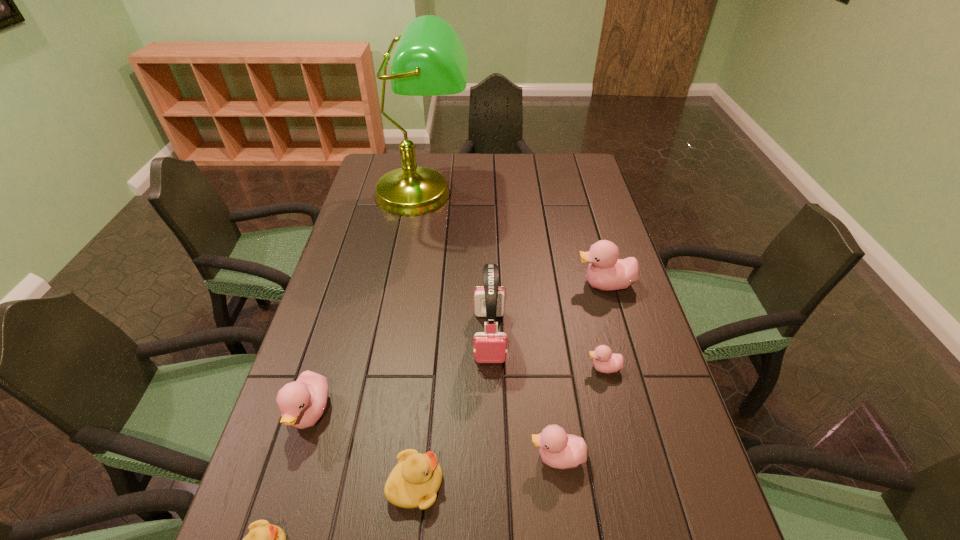
Identify the location of object that is the nearest to the nearest duckling. Image resolution: width=960 pixels, height=540 pixels. click(302, 402).

Locate an element on the screen. object that is the seventh closest to the farthest duckling is located at coordinates (264, 539).

Select which duckling appears as the second closest to the second biggest pink duckling. Please provide its 2D coordinates. Your answer should be formatted as a tuple, i.e. [(x, y)], where the tuple contains the x and y coordinates of a point satisfying the conditions above.

[(414, 482)]

Select which duckling appears as the second closest to the fifth nearest duckling. Please provide its 2D coordinates. Your answer should be formatted as a tuple, i.e. [(x, y)], where the tuple contains the x and y coordinates of a point satisfying the conditions above.

[(606, 272)]

Locate which pink duckling is the second closest to the farthest pink duckling. Please provide its 2D coordinates. Your answer should be formatted as a tuple, i.e. [(x, y)], where the tuple contains the x and y coordinates of a point satisfying the conditions above.

[(559, 450)]

Identify the location of pink duckling identified as the second closest to the tallest duckling. Image resolution: width=960 pixels, height=540 pixels. [559, 450].

At what (x,y) coordinates should I click in order to perform the action: click on blank area in the image that satisfies the following two spatial constraints: 1. on the outer surface of the pink earphone; 2. on the front-facing side of the bigger yellow duckling. Please return your answer as a coordinate pair (x, y). Image resolution: width=960 pixels, height=540 pixels. Looking at the image, I should click on (492, 484).

This screenshot has width=960, height=540. Find the location of `free spot that satisfies the following two spatial constraints: 1. on the front-facing side of the tallest duckling; 2. on the outer surface of the second tallest object`. free spot that satisfies the following two spatial constraints: 1. on the front-facing side of the tallest duckling; 2. on the outer surface of the second tallest object is located at coordinates (619, 336).